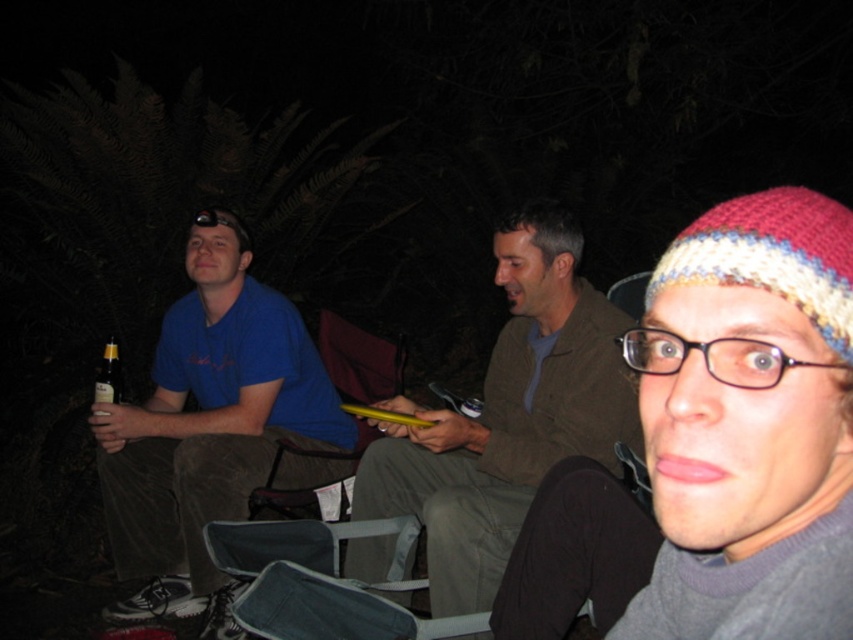
Who is more forward, (830,260) or (115,611)?

Positioned in front is point (830,260).

Is knitted wool hat at upper right positioned at the back of blue cotton shirt at left?

No, knitted wool hat at upper right is closer to the viewer.

Measure the distance between knitted wool hat at upper right and camera.

They are 18.68 inches apart.

Identify the location of knitted wool hat at upper right. Image resolution: width=853 pixels, height=640 pixels. point(749,424).

Who is higher up, blue cotton shirt at left or brown glass bottle at lower left?

brown glass bottle at lower left is above.

Can you confirm if blue cotton shirt at left is wider than brown glass bottle at lower left?

Yes, blue cotton shirt at left is wider than brown glass bottle at lower left.

I want to click on blue cotton shirt at left, so click(x=207, y=428).

Between knitted wool hat at upper right and brown glass bottle at lower left, which one has less height?

brown glass bottle at lower left

Which is more to the right, knitted wool hat at upper right or brown glass bottle at lower left?

From the viewer's perspective, knitted wool hat at upper right appears more on the right side.

Between point (784, 387) and point (111, 337), which one is positioned in front?

Point (784, 387) is in front.

Image resolution: width=853 pixels, height=640 pixels. In order to click on knitted wool hat at upper right in this screenshot , I will do `click(749, 424)`.